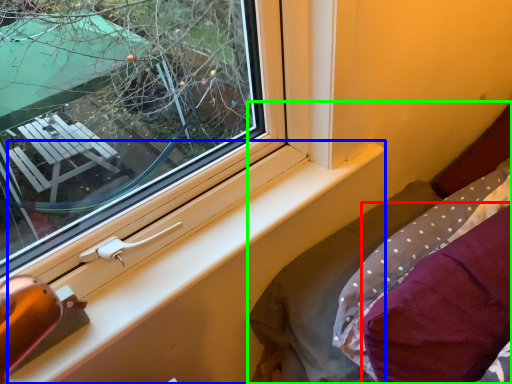
Question: Based on their relative distances, which object is farther from pillow (highlighted by a red box)? Choose from window sill (highlighted by a blue box) and bed (highlighted by a green box).

Choices:
 (A) window sill
 (B) bed

Answer: (A)